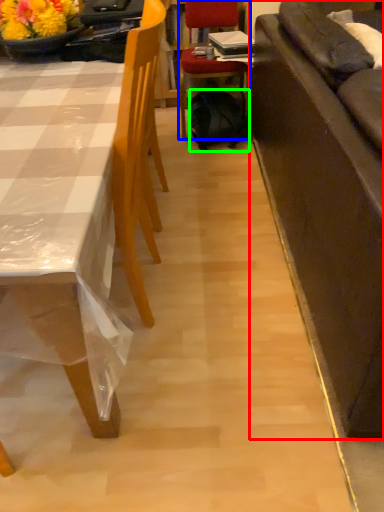
Question: Which object is positioned closest to studio couch (highlighted by a red box)? Select from chair (highlighted by a blue box) and backpack (highlighted by a green box).

Choices:
 (A) chair
 (B) backpack

Answer: (B)